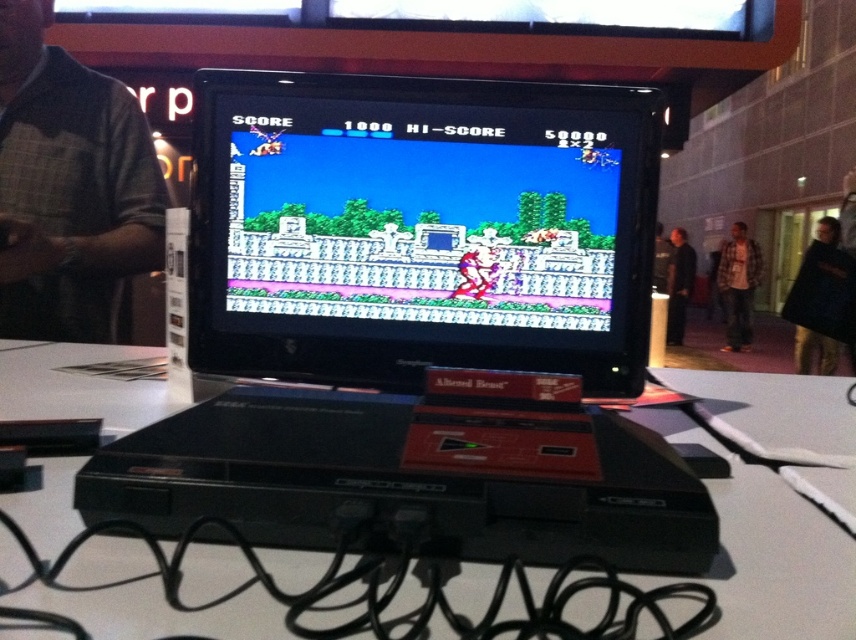
You are a character in the game and you see two points in the game world. The first point is at point (235, 408) and the second point is at point (811, 381). Which point is closer to you?

The point at (235, 408) is closer to you than the point at (811, 381).

You are organizing a retro gaming event and need to place the plaid flannel shirt at center and the black leather jacket at right on a shelf. Which item takes up more horizontal space on the shelf?

The plaid flannel shirt at center has a greater width than the black leather jacket at right, so it takes up more horizontal space on the shelf.

You are organizing a retro gaming event and need to set up a display table. You have two items to place on the table next to the Sega Genesis console. The items are the black fabric at right and the black leather jacket at right. According to the image, where should you place each item relative to the Sega Genesis console?

The black fabric at right should be placed under the black leather jacket at right on the table next to the Sega Genesis console.